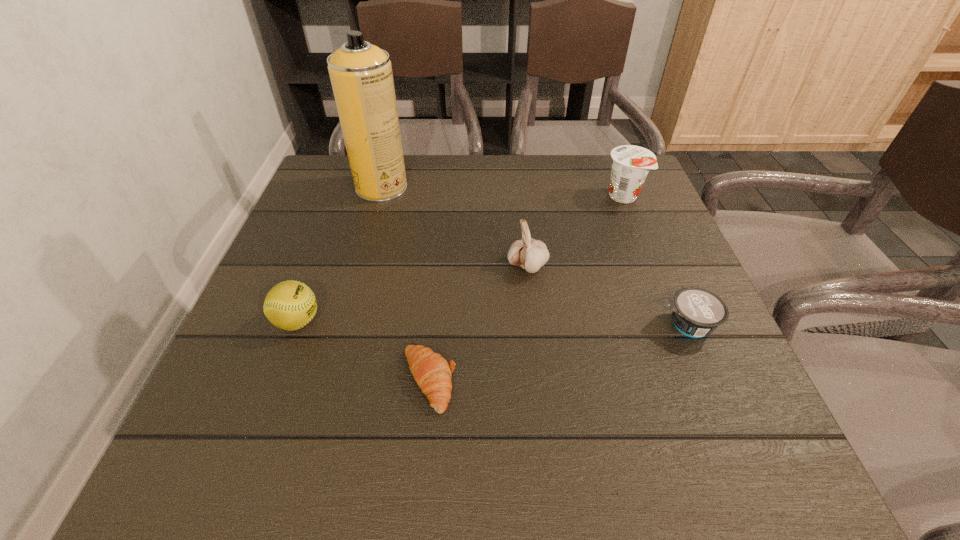
Find the location of a particular element. Image resolution: width=960 pixels, height=540 pixels. free space located on the front of the farther yogurt is located at coordinates (664, 300).

This screenshot has height=540, width=960. Find the location of `free space located on the left of the third farthest object`. free space located on the left of the third farthest object is located at coordinates (448, 266).

Where is `vacant space located 0.330m on the logo side of the fourth tallest object`? vacant space located 0.330m on the logo side of the fourth tallest object is located at coordinates (502, 321).

Locate an element on the screen. This screenshot has height=540, width=960. free space located 0.080m on the back of the second shortest object is located at coordinates (666, 276).

Identify the location of free point located on the front of the crescent roll. The image size is (960, 540). (420, 469).

This screenshot has height=540, width=960. What are the coordinates of `aerosol can that is at the far edge` in the screenshot? It's located at (361, 76).

The width and height of the screenshot is (960, 540). I want to click on yogurt at the far edge, so click(x=630, y=164).

Locate an element on the screen. aerosol can located in the left edge section of the desktop is located at coordinates (361, 76).

The height and width of the screenshot is (540, 960). Identify the location of softball at the left edge. (290, 305).

The height and width of the screenshot is (540, 960). What are the coordinates of `object located in the far left corner section of the desktop` in the screenshot? It's located at (361, 76).